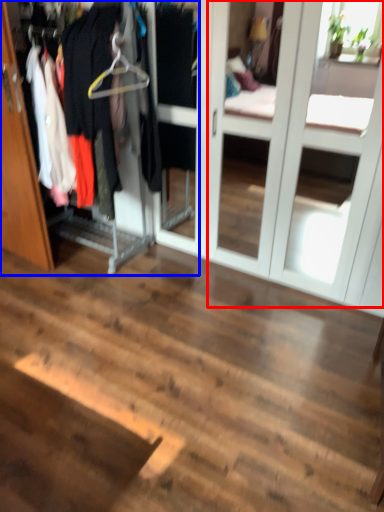
Question: Which of the following is the closest to the observer, screen door (highlighted by a red box) or closet (highlighted by a blue box)?

Choices:
 (A) screen door
 (B) closet

Answer: (A)